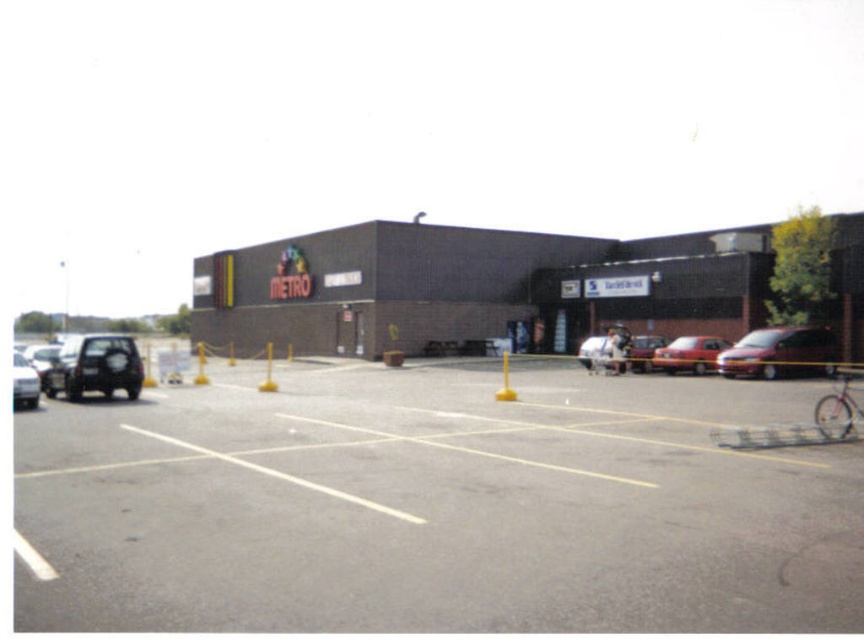
Is the position of gray asphalt parking lot at center less distant than that of matte red car at right?

Yes, gray asphalt parking lot at center is in front of matte red car at right.

Can you confirm if gray asphalt parking lot at center is taller than matte red car at right?

Incorrect, gray asphalt parking lot at center's height is not larger of matte red car at right's.

At what (x,y) coordinates should I click in order to perform the action: click on gray asphalt parking lot at center. Please return your answer as a coordinate pair (x, y). Looking at the image, I should click on (436, 506).

From the picture: Is matte black suv at left shorter than matte red car at right?

No.

Is matte black suv at left further to the viewer compared to matte red car at right?

No, matte black suv at left is closer to the viewer.

Is point (62, 372) farther from camera compared to point (699, 339)?

No, it is in front of (699, 339).

Locate an element on the screen. The image size is (864, 640). matte black suv at left is located at coordinates (94, 365).

Is matte red car at right smaller than white glossy car at left?

Correct, matte red car at right occupies less space than white glossy car at left.

Which is more to the left, matte red car at right or white glossy car at left?

white glossy car at left is more to the left.

The image size is (864, 640). In order to click on matte red car at right in this screenshot , I will do `click(688, 355)`.